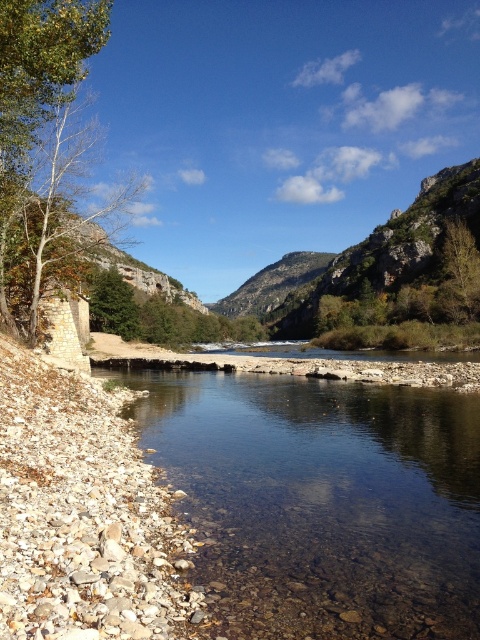
You are standing at the edge of the river and want to cross to the other side. There is a clear water at center and a rocky cliff at upper center in your view. Which direction should you head towards to find shallower water for easier crossing?

You should head towards the clear water at center because it is located to the left of the rocky cliff at upper center, indicating it might be the shallow area with visible pebbles mentioned in the scene description, making it easier to cross.